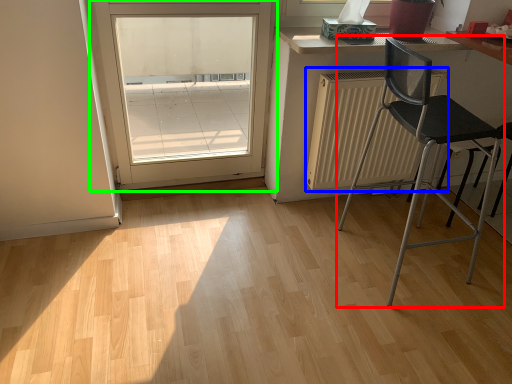
Question: Based on their relative distances, which object is nearer to chair (highlighted by a red box)? Choose from radiator (highlighted by a blue box) and door (highlighted by a green box).

Choices:
 (A) radiator
 (B) door

Answer: (A)